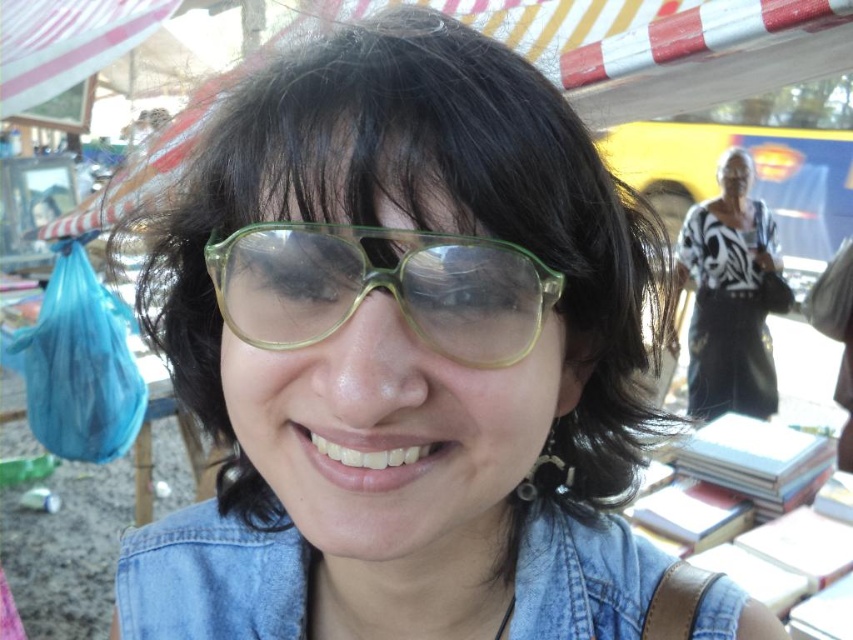
Question: Among these objects, which one is nearest to the camera?

Choices:
 (A) black and white patterned sweater at upper right
 (B) translucent yellow-green goggles at center
 (C) denim jacket at lower right

Answer: (B)

Question: Can you confirm if translucent yellow-green goggles at center is positioned to the left of black and white patterned sweater at upper right?

Choices:
 (A) no
 (B) yes

Answer: (B)

Question: Which point is farther to the camera?

Choices:
 (A) denim jacket at lower right
 (B) black and white patterned sweater at upper right

Answer: (B)

Question: Which point appears farthest from the camera in this image?

Choices:
 (A) (450, 307)
 (B) (705, 600)
 (C) (718, 285)

Answer: (C)

Question: Is denim jacket at lower right positioned in front of black and white patterned sweater at upper right?

Choices:
 (A) no
 (B) yes

Answer: (B)

Question: Can you confirm if denim jacket at lower right is bigger than translucent yellow-green goggles at center?

Choices:
 (A) yes
 (B) no

Answer: (A)